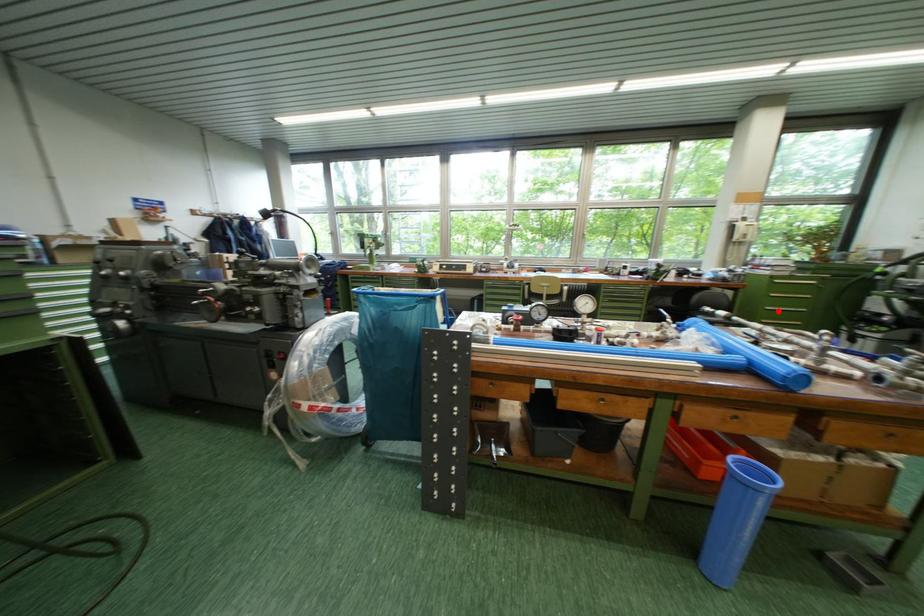
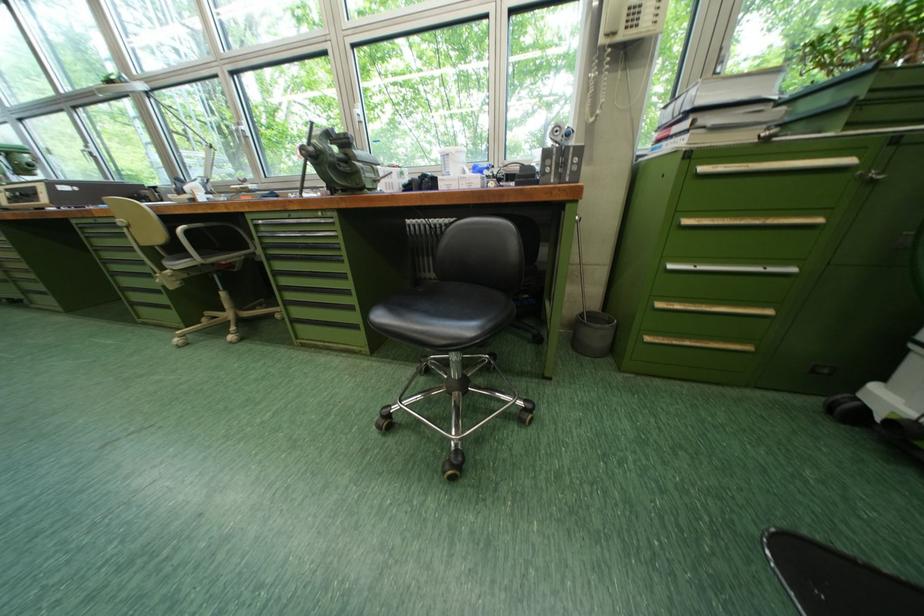
In the second image, find the point that corresponds to the highlighted location in the first image.

(681, 269)